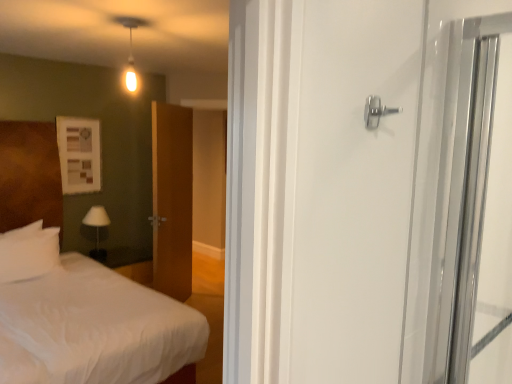
In order to click on white fabric lampshade at left in this screenshot , I will do `click(97, 226)`.

From a real-world perspective, is polished silver door handle at upper right over white soft bed at left?

Correct, in the physical world, polished silver door handle at upper right is higher than white soft bed at left.

Can you confirm if polished silver door handle at upper right is smaller than white soft bed at left?

Indeed, polished silver door handle at upper right has a smaller size compared to white soft bed at left.

Would you say polished silver door handle at upper right is outside white soft bed at left?

polished silver door handle at upper right is positioned outside white soft bed at left.

Can you confirm if polished silver door handle at upper right is taller than white soft bed at left?

In fact, polished silver door handle at upper right may be shorter than white soft bed at left.

Which object is more forward, white soft bed at left or white soft pillow at left?

Positioned in front is white soft bed at left.

Does white soft bed at left appear on the left side of white soft pillow at left?

No.

From a real-world perspective, which is physically above, polished silver door handle at upper right or white soft pillow at left?

From a 3D spatial view, polished silver door handle at upper right is above.

Is polished silver door handle at upper right wider than white soft pillow at left?

Incorrect, the width of polished silver door handle at upper right does not surpass that of white soft pillow at left.

Is the position of polished silver door handle at upper right more distant than that of white soft pillow at left?

No, polished silver door handle at upper right is closer to the camera.

From the image's perspective, is polished silver door handle at upper right located above or below white fabric lampshade at left?

polished silver door handle at upper right is above white fabric lampshade at left.

Is polished silver door handle at upper right looking in the opposite direction of white fabric lampshade at left?

A: Yes.

Does polished silver door handle at upper right lie in front of white fabric lampshade at left?

Yes, the depth of polished silver door handle at upper right is less than that of white fabric lampshade at left.

Who is smaller, polished silver door handle at upper right or white fabric lampshade at left?

Smaller between the two is polished silver door handle at upper right.

Would you say white soft bed at left is inside or outside polished silver door handle at upper right?

The correct answer is: outside.

Considering the sizes of white soft bed at left and polished silver door handle at upper right in the image, is white soft bed at left taller or shorter than polished silver door handle at upper right?

In the image, white soft bed at left appears to be taller than polished silver door handle at upper right.

Which of these two, white soft bed at left or polished silver door handle at upper right, is smaller?

polished silver door handle at upper right is smaller.

Between point (10, 199) and point (368, 106), which one is positioned behind?

The point (10, 199) is more distant.

Which of these two, white soft bed at left or white fabric lampshade at left, stands taller?

With more height is white soft bed at left.

Is white soft bed at left wider or thinner than white fabric lampshade at left?

Clearly, white soft bed at left has more width compared to white fabric lampshade at left.

Is white soft bed at left smaller than white fabric lampshade at left?

No, white soft bed at left is not smaller than white fabric lampshade at left.

Is white fabric lampshade at left surrounded by white soft bed at left?

No, white fabric lampshade at left is located outside of white soft bed at left.

Can polished silver door handle at upper right be found inside white soft pillow at left?

That's incorrect, polished silver door handle at upper right is not inside white soft pillow at left.

Is white soft pillow at left positioned in front of polished silver door handle at upper right?

No, the depth of white soft pillow at left is greater than that of polished silver door handle at upper right.

Can you confirm if white soft pillow at left is smaller than polished silver door handle at upper right?

No.

From a real-world perspective, which is physically above, white soft pillow at left or polished silver door handle at upper right?

polished silver door handle at upper right is physically above.

Where is `bed that appears below the polished silver door handle at upper right (from the image's perspective)`? bed that appears below the polished silver door handle at upper right (from the image's perspective) is located at coordinates (29, 174).

The width and height of the screenshot is (512, 384). I want to click on pillow lying behind the white soft bed at left, so click(28, 252).

Considering their positions, is white soft pillow at left positioned closer to polished silver door handle at upper right than white soft bed at left?

white soft pillow at left lies closer to polished silver door handle at upper right than the other object.

Looking at the image, which one is located further to white fabric lampshade at left, polished silver door handle at upper right or white soft bed at left?

polished silver door handle at upper right.

When comparing their distances from white soft bed at left, does white fabric lampshade at left or polished silver door handle at upper right seem further?

polished silver door handle at upper right is positioned further to the anchor white soft bed at left.

Estimate the real-world distances between objects in this image. Which object is closer to white fabric lampshade at left, white soft pillow at left or polished silver door handle at upper right?

white soft pillow at left is closer to white fabric lampshade at left.

Considering their positions, is white fabric lampshade at left positioned further to polished silver door handle at upper right than white soft pillow at left?

white fabric lampshade at left is positioned further to the anchor polished silver door handle at upper right.

Which object lies further to the anchor point white fabric lampshade at left, white soft pillow at left or white soft bed at left?

white soft pillow at left.

Which object lies further to the anchor point white soft pillow at left, white soft bed at left or white fabric lampshade at left?

white fabric lampshade at left is further to white soft pillow at left.

Looking at the image, which one is located closer to white fabric lampshade at left, white soft bed at left or polished silver door handle at upper right?

white soft bed at left is closer to white fabric lampshade at left.

Image resolution: width=512 pixels, height=384 pixels. I want to click on pillow located between white soft bed at left and white fabric lampshade at left in the depth direction, so click(28, 252).

Where is `bed between polished silver door handle at upper right and white soft pillow at left along the z-axis`? bed between polished silver door handle at upper right and white soft pillow at left along the z-axis is located at coordinates (29, 174).

Where is `bed positioned between polished silver door handle at upper right and white fabric lampshade at left from near to far`? bed positioned between polished silver door handle at upper right and white fabric lampshade at left from near to far is located at coordinates (29, 174).

Locate an element on the screen. This screenshot has height=384, width=512. pillow between polished silver door handle at upper right and white fabric lampshade at left along the z-axis is located at coordinates (28, 252).